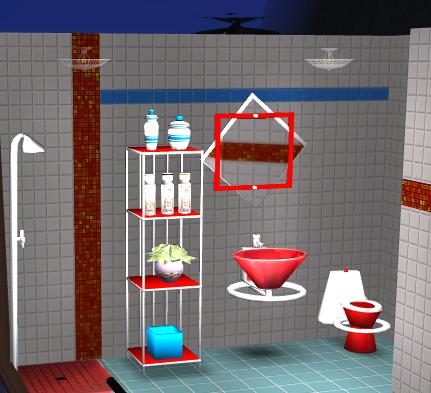
In order to click on shower in this screenshot , I will do `click(28, 141)`.